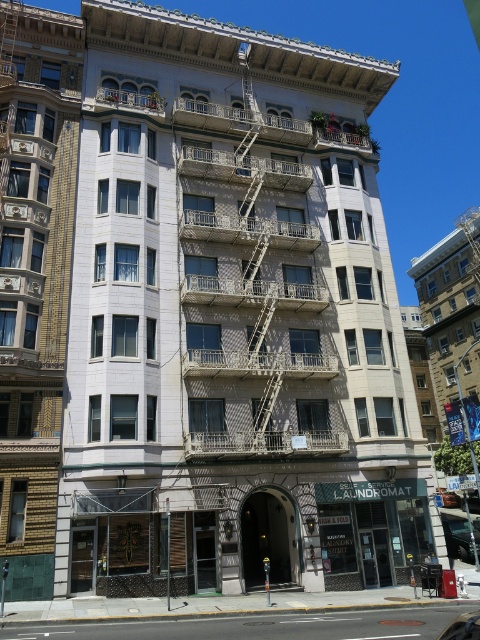
Which of these two, metallic silver fire escape at center or metallic silver car at center, stands shorter?

Standing shorter between the two is metallic silver car at center.

Is metallic silver fire escape at center positioned before metallic silver car at center?

Yes, metallic silver fire escape at center is in front of metallic silver car at center.

Does point (315, 202) come in front of point (441, 493)?

Yes.

Identify the location of metallic silver fire escape at center. (253, 280).

Who is higher up, metallic silver car at lower right or metallic silver car at center?

metallic silver car at lower right

Is metallic silver car at lower right smaller than metallic silver car at center?

Actually, metallic silver car at lower right might be larger than metallic silver car at center.

Is point (453, 627) farther from viewer compared to point (444, 490)?

No, it is not.

This screenshot has height=640, width=480. In order to click on metallic silver car at lower right in this screenshot , I will do `click(463, 627)`.

Is metallic silver fire escape at center to the right of metallic silver car at lower right from the viewer's perspective?

Incorrect, metallic silver fire escape at center is not on the right side of metallic silver car at lower right.

Between point (264, 390) and point (468, 621), which one is positioned behind?

Point (264, 390)

You are a GUI agent. You are given a task and a screenshot of the screen. Output one action in this format:
    pyautogui.click(x=<x>, y=<y>)
    Task: Click on the metallic silver fire escape at center
    Image resolution: width=480 pixels, height=640 pixels.
    Given the screenshot: What is the action you would take?
    pyautogui.click(x=253, y=280)